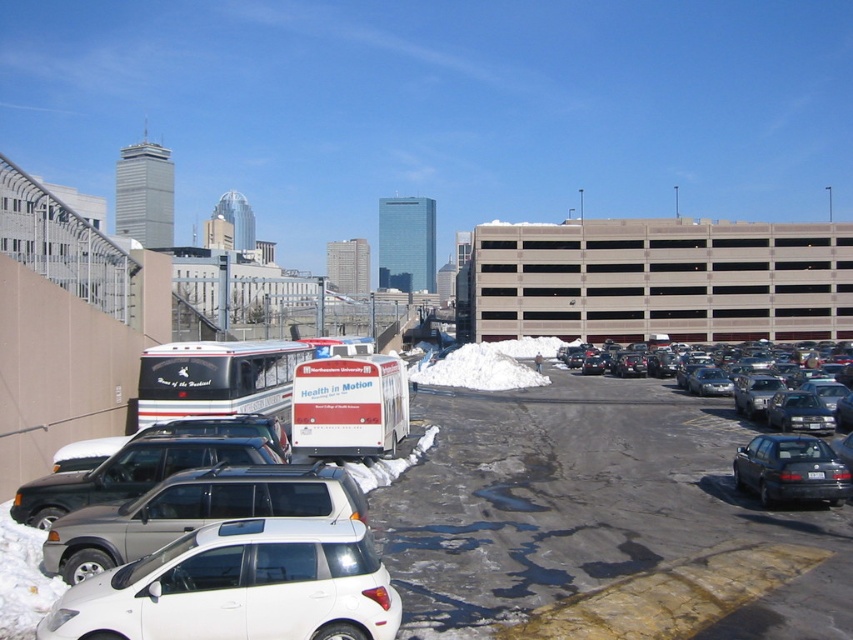
Between point (184, 588) and point (370, 388), which one is positioned behind?

The point (370, 388) is behind.

This screenshot has width=853, height=640. Describe the element at coordinates (239, 588) in the screenshot. I see `white matte hatchback at lower left` at that location.

Which is in front, point (187, 616) or point (354, 369)?

Point (187, 616) is in front.

The image size is (853, 640). In order to click on white matte hatchback at lower left in this screenshot , I will do `click(239, 588)`.

Is point (386, 422) closer to camera compared to point (778, 392)?

Yes, it is in front of point (778, 392).

Can you confirm if white matte van at center is thinner than black glossy sedan at right?

In fact, white matte van at center might be wider than black glossy sedan at right.

Who is more distant from viewer, [328,396] or [810,406]?

The point [810,406] is more distant.

I want to click on white matte van at center, so click(x=349, y=406).

Where is `white matte hatchback at center`? This screenshot has width=853, height=640. white matte hatchback at center is located at coordinates (194, 512).

Is point (51, 529) in front of point (338, 385)?

Yes, it is.

Describe the element at coordinates (194, 512) in the screenshot. The image size is (853, 640). I see `white matte hatchback at center` at that location.

I want to click on white matte hatchback at center, so click(194, 512).